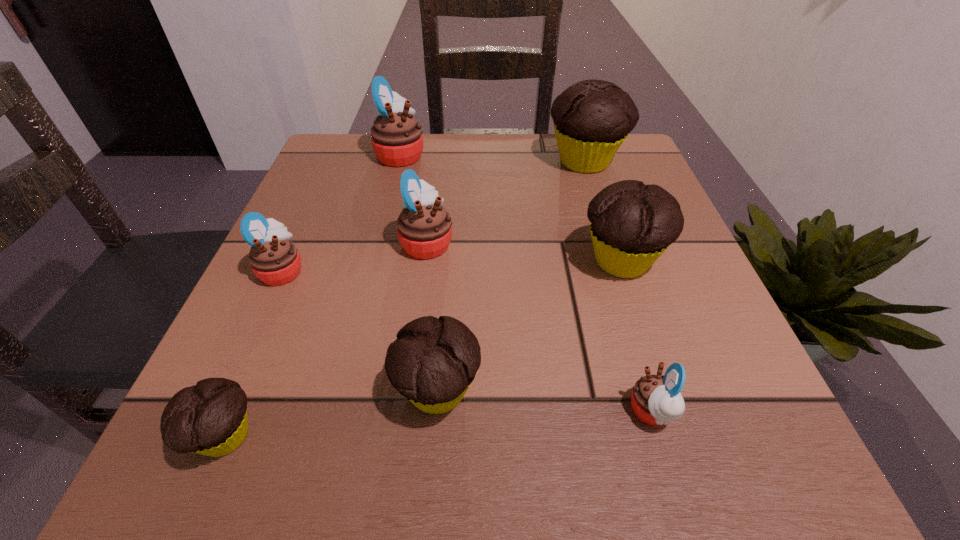
Locate an element on the screen. This screenshot has height=540, width=960. object that is the second closest to the third nearest chocolate muffin is located at coordinates (656, 400).

Locate which muffin ranks in proximity to the rightmost pink muffin. Please provide its 2D coordinates. Your answer should be formatted as a tuple, i.e. [(x, y)], where the tuple contains the x and y coordinates of a point satisfying the conditions above.

[(632, 224)]

Select which muffin appears as the fifth closest to the nearest pink muffin. Please provide its 2D coordinates. Your answer should be formatted as a tuple, i.e. [(x, y)], where the tuple contains the x and y coordinates of a point satisfying the conditions above.

[(592, 118)]

Select which pink muffin is the fourth closest to the smallest chocolate muffin. Please provide its 2D coordinates. Your answer should be formatted as a tuple, i.e. [(x, y)], where the tuple contains the x and y coordinates of a point satisfying the conditions above.

[(397, 140)]

I want to click on the closest pink muffin to the second chocolate muffin from left to right, so coord(424,227).

Find the location of a particular element. This screenshot has height=540, width=960. chocolate muffin that is the third closest to the third biggest chocolate muffin is located at coordinates (592, 118).

Select which chocolate muffin is the second closest to the farthest chocolate muffin. Please provide its 2D coordinates. Your answer should be formatted as a tuple, i.e. [(x, y)], where the tuple contains the x and y coordinates of a point satisfying the conditions above.

[(432, 363)]

The image size is (960, 540). I want to click on free space that satisfies the following two spatial constraints: 1. on the front-facing side of the biggest pink muffin; 2. on the left side of the third chocolate muffin from right to left, so click(x=342, y=391).

I want to click on free location that satisfies the following two spatial constraints: 1. on the back side of the second smallest chocolate muffin; 2. on the right side of the biggest chocolate muffin, so click(x=455, y=161).

The height and width of the screenshot is (540, 960). Find the location of `free spot that satisfies the following two spatial constraints: 1. on the front-facing side of the biggest pink muffin; 2. on the back side of the biggest chocolate muffin`. free spot that satisfies the following two spatial constraints: 1. on the front-facing side of the biggest pink muffin; 2. on the back side of the biggest chocolate muffin is located at coordinates (398, 161).